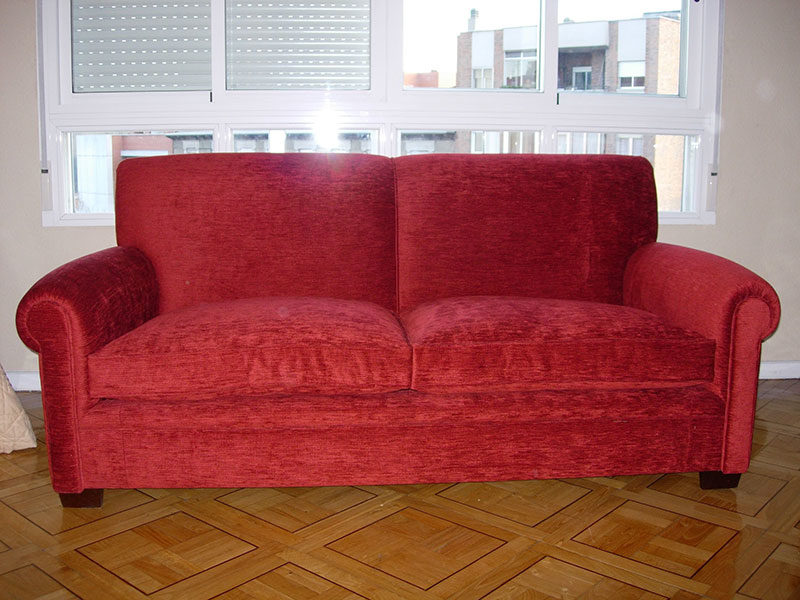
Locate an element on the screen. backrest is located at coordinates (238, 285), (453, 283).